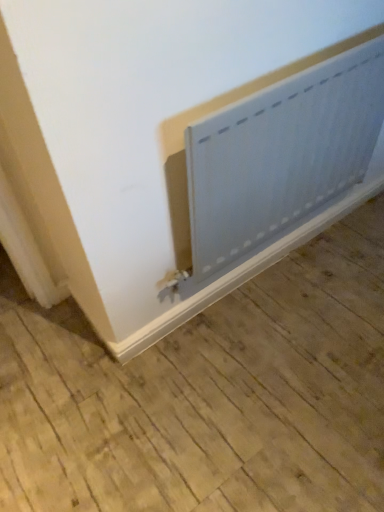
The height and width of the screenshot is (512, 384). What are the coordinates of `vacant space underneath white matte radiator at lower center (from a real-world perspective)` in the screenshot? It's located at (269, 278).